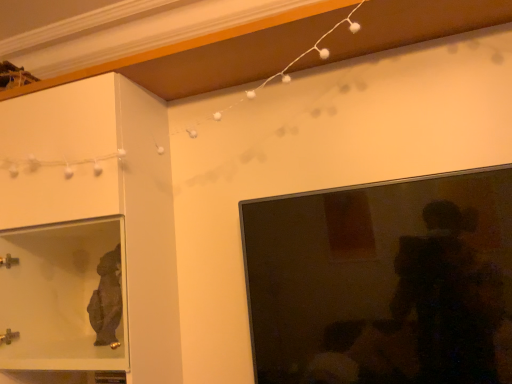
Question: In the image, is matte black tv at right on the left side or the right side of matte glass cabinet at left?

Choices:
 (A) left
 (B) right

Answer: (B)

Question: Is point (403, 301) closer or farther from the camera than point (154, 97)?

Choices:
 (A) closer
 (B) farther

Answer: (A)

Question: From a real-world perspective, relative to matte glass cabinet at left, is matte black tv at right vertically above or below?

Choices:
 (A) above
 (B) below

Answer: (B)

Question: Would you say matte glass cabinet at left is to the left or to the right of matte black tv at right in the picture?

Choices:
 (A) left
 (B) right

Answer: (A)

Question: From their relative heights in the image, would you say matte glass cabinet at left is taller or shorter than matte black tv at right?

Choices:
 (A) tall
 (B) short

Answer: (A)

Question: Looking at the image, does matte glass cabinet at left seem bigger or smaller compared to matte black tv at right?

Choices:
 (A) small
 (B) big

Answer: (B)

Question: Is matte glass cabinet at left wider or thinner than matte black tv at right?

Choices:
 (A) thin
 (B) wide

Answer: (B)